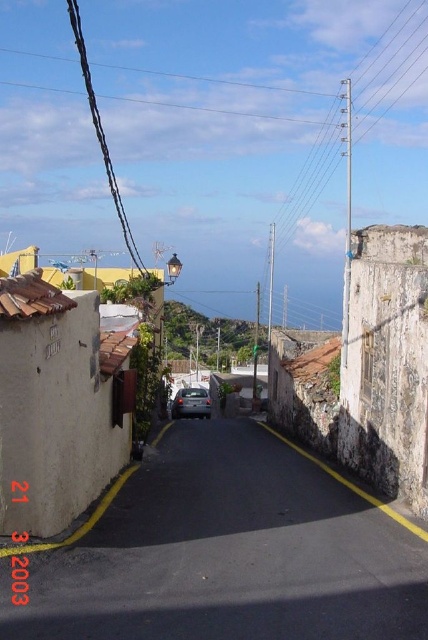
Between black asphalt road at center and stucco wall at right, which one has more height?

With more height is stucco wall at right.

Who is lower down, black asphalt road at center or stucco wall at right?

black asphalt road at center is lower down.

Where is `black asphalt road at center`? black asphalt road at center is located at coordinates (228, 552).

The width and height of the screenshot is (428, 640). Identify the location of black asphalt road at center. (228, 552).

Can you confirm if black asphalt road at center is positioned to the left of satin black car at center?

In fact, black asphalt road at center is to the right of satin black car at center.

Where is `black asphalt road at center`? The width and height of the screenshot is (428, 640). black asphalt road at center is located at coordinates (228, 552).

Can you confirm if stucco wall at right is taller than satin black car at center?

Yes.

Which is in front, point (419, 330) or point (202, 408)?

Point (419, 330) is more forward.

Locate an element on the screen. The height and width of the screenshot is (640, 428). stucco wall at right is located at coordinates (386, 364).